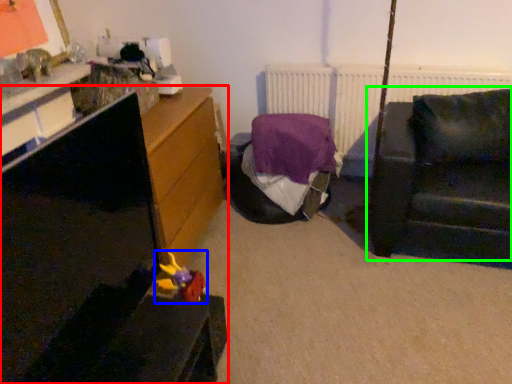
Question: Which object is positioned farthest from furniture (highlighted by a red box)? Select from toy (highlighted by a blue box) and studio couch (highlighted by a green box).

Choices:
 (A) toy
 (B) studio couch

Answer: (B)